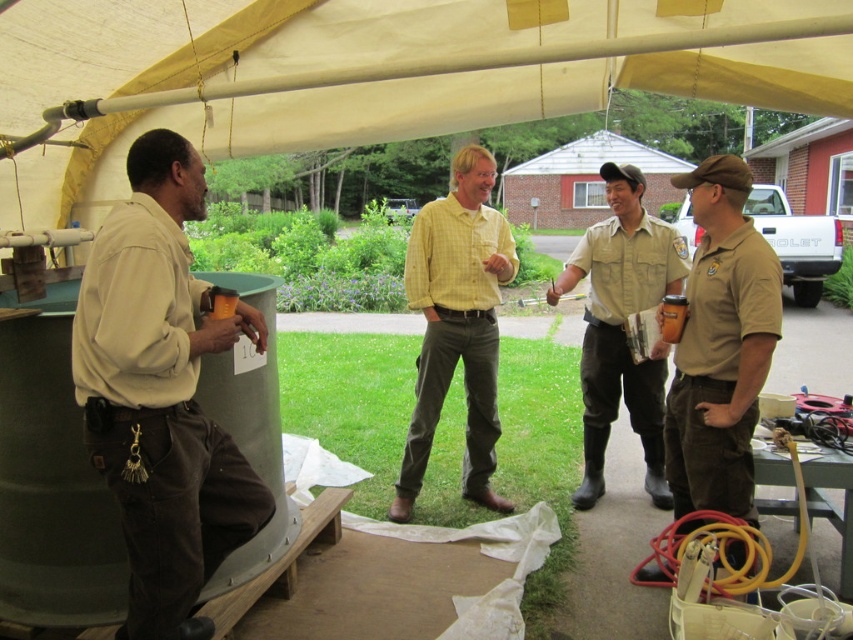
You are a photographer trying to capture a photo of the matte khaki shirt at left and the khaki uniform at center. From the photographer perspective, which one is positioned lower in the frame?

The matte khaki shirt at left is located below the khaki uniform at center, so it is positioned lower in the frame.

You are organizing a team photo and need to arrange the matte khaki shirt at left and the yellow checkered shirt at center based on their sizes. Which shirt should you place on the side if you want the thinner one to be in the middle?

The matte khaki shirt at left is thinner than the yellow checkered shirt at center, so you should place the matte khaki shirt at left in the middle and the thicker yellow checkered shirt at center on the side.

You are standing in front of the tent and see the matte khaki shirt at left and the matte khaki uniform at right. Which one is positioned more to the left side?

The matte khaki shirt at left is positioned more to the left side than the matte khaki uniform at right.